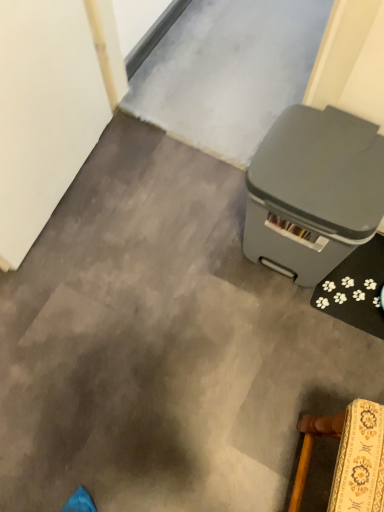
Image resolution: width=384 pixels, height=512 pixels. What are the coordinates of `free location above gray plastic waste bin at right (from a real-world perspective)` in the screenshot? It's located at (329, 159).